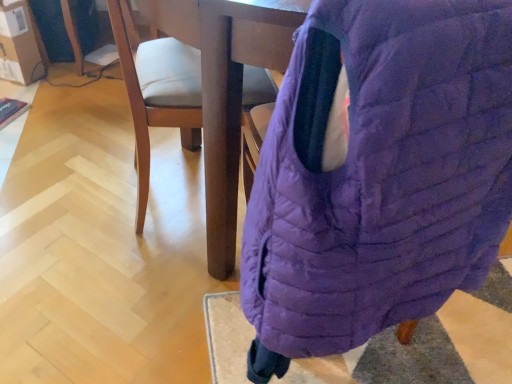
Question: Is purple quilted bean bag chair at center at the left side of matte brown cardboard at upper left?

Choices:
 (A) yes
 (B) no

Answer: (B)

Question: Is purple quilted bean bag chair at center smaller than matte brown cardboard at upper left?

Choices:
 (A) yes
 (B) no

Answer: (B)

Question: Can you confirm if purple quilted bean bag chair at center is thinner than matte brown cardboard at upper left?

Choices:
 (A) yes
 (B) no

Answer: (B)

Question: Could you tell me if purple quilted bean bag chair at center is facing matte brown cardboard at upper left?

Choices:
 (A) yes
 (B) no

Answer: (B)

Question: Is matte brown cardboard at upper left completely or partially inside purple quilted bean bag chair at center?

Choices:
 (A) no
 (B) yes

Answer: (A)

Question: Based on their positions, is matte brown cardboard at upper left located to the left or right of purple quilted bean bag chair at center?

Choices:
 (A) right
 (B) left

Answer: (B)

Question: From a real-world perspective, is matte brown cardboard at upper left positioned above or below purple quilted bean bag chair at center?

Choices:
 (A) above
 (B) below

Answer: (B)

Question: Is matte brown cardboard at upper left bigger or smaller than purple quilted bean bag chair at center?

Choices:
 (A) big
 (B) small

Answer: (B)

Question: Is point (30, 81) closer or farther from the camera than point (388, 114)?

Choices:
 (A) farther
 (B) closer

Answer: (A)

Question: Is point (190, 122) closer or farther from the camera than point (459, 135)?

Choices:
 (A) farther
 (B) closer

Answer: (A)

Question: Visually, is light brown wood chair at center positioned to the left or to the right of purple quilted bean bag chair at center?

Choices:
 (A) left
 (B) right

Answer: (A)

Question: Is light brown wood chair at center wider or thinner than purple quilted bean bag chair at center?

Choices:
 (A) wide
 (B) thin

Answer: (B)

Question: In terms of size, does light brown wood chair at center appear bigger or smaller than purple quilted bean bag chair at center?

Choices:
 (A) small
 (B) big

Answer: (A)

Question: Is purple quilted bean bag chair at center to the left or to the right of matte brown cardboard at upper left in the image?

Choices:
 (A) left
 (B) right

Answer: (B)

Question: Does point (470, 28) appear closer or farther from the camera than point (34, 59)?

Choices:
 (A) closer
 (B) farther

Answer: (A)